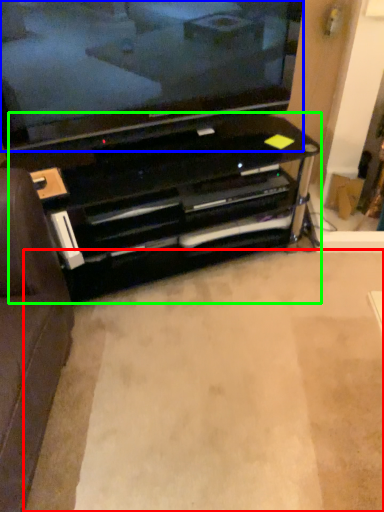
Question: Which object is positioned farthest from plain (highlighted by a red box)? Select from television (highlighted by a blue box) and entertainment center (highlighted by a green box).

Choices:
 (A) television
 (B) entertainment center

Answer: (A)